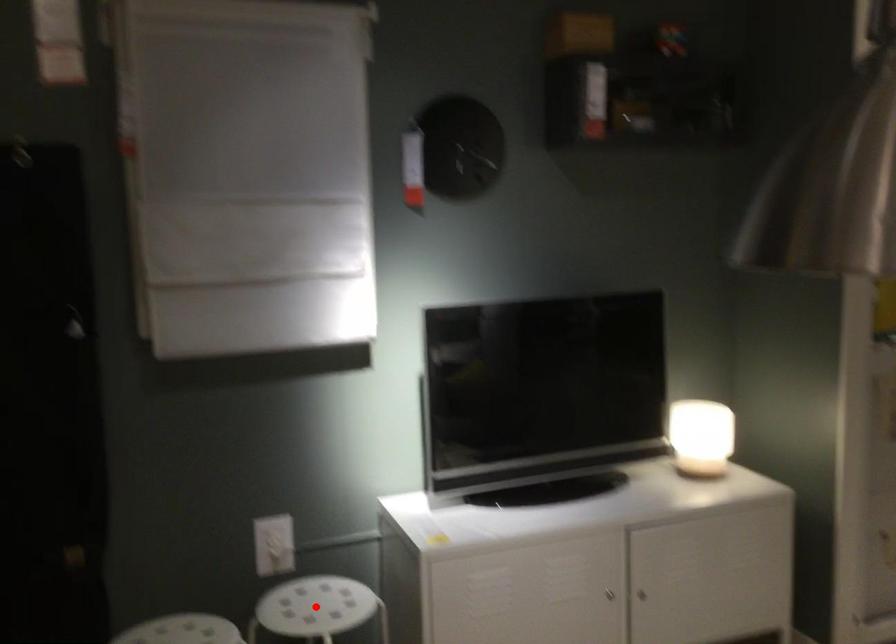
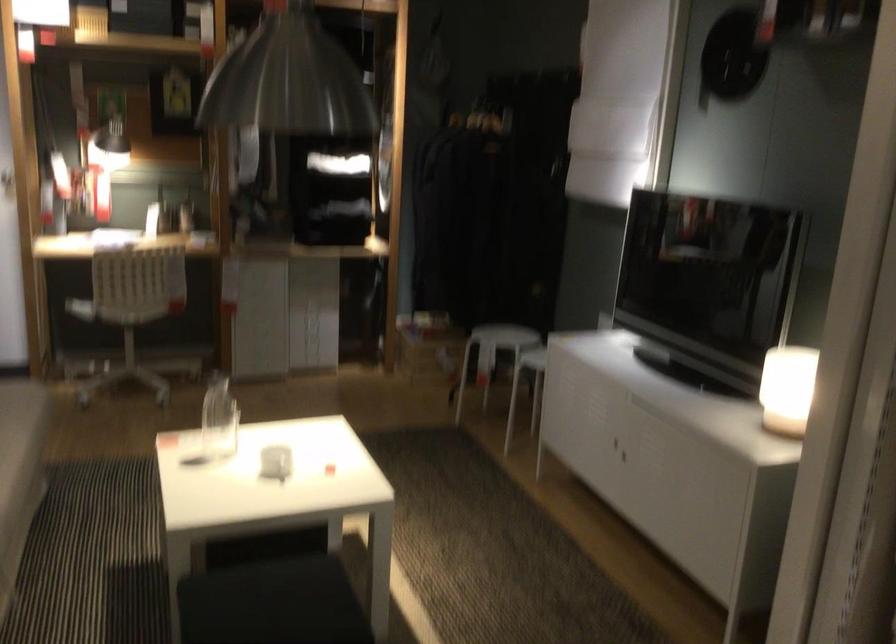
Question: I am providing you with two images of the same scene from different viewpoints. A red point is marked on the first image. Is the red point's position out of view in image 2?

Choices:
 (A) Yes
 (B) No

Answer: (A)